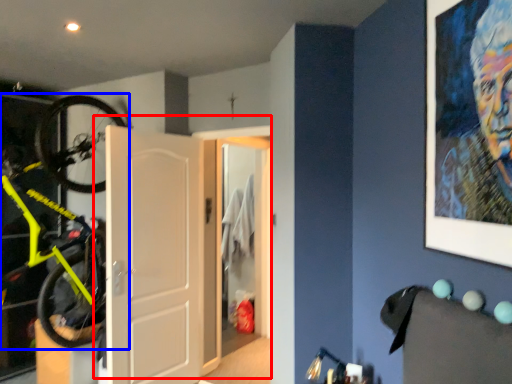
Question: Which object appears farthest to the camera in this image, door (highlighted by a red box) or bicycle (highlighted by a blue box)?

Choices:
 (A) door
 (B) bicycle

Answer: (A)